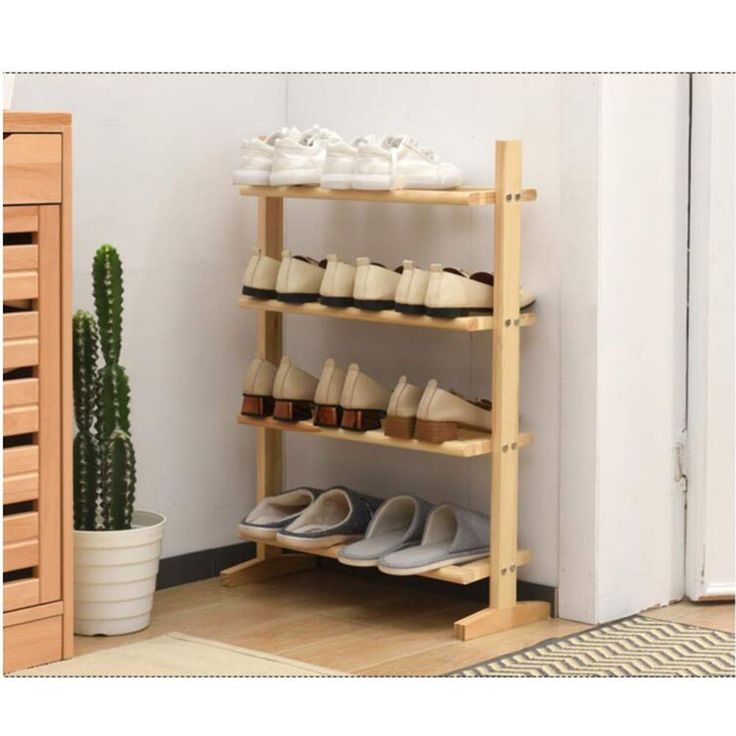
Where is `drawers`? The height and width of the screenshot is (736, 736). drawers is located at coordinates (14, 272), (26, 335), (15, 403), (21, 478), (15, 542), (35, 180).